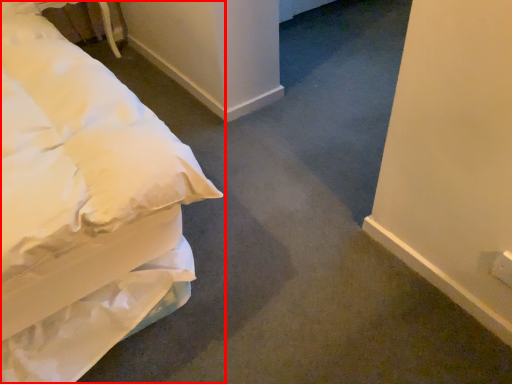
Question: Where is bed (annotated by the red box) located in relation to table in the image?

Choices:
 (A) right
 (B) left

Answer: (A)